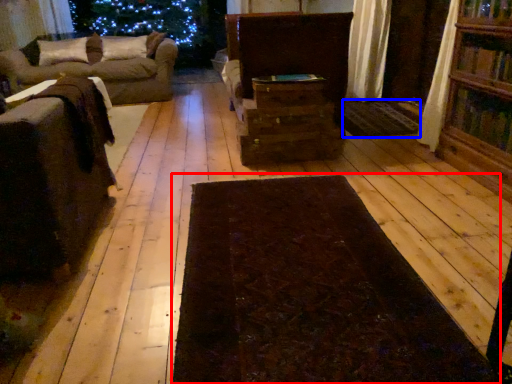
Question: Which object is closer to the camera taking this photo, mat (highlighted by a red box) or mat (highlighted by a blue box)?

Choices:
 (A) mat
 (B) mat

Answer: (A)